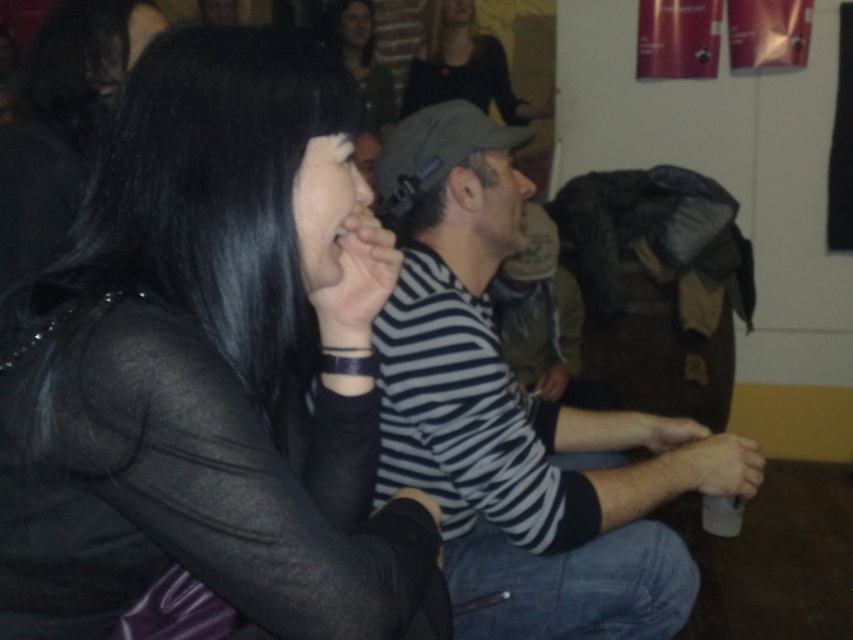
Consider the image. You are a photographer trying to capture a candid shot of the matte black hair at upper center and the white matte cup at lower center. Which object is closer to the camera lens?

The matte black hair at upper center is closer to the camera lens because it is further to the viewer than the white matte cup at lower center.

You are a photographer adjusting your camera settings to capture a closeup of the smooth beige sweater at upper center and the matte black hair at upper center. Given the camera has a depth of field that can sharply focus on objects within 30 centimeters of each other, will both subjects be in focus?

The smooth beige sweater at upper center and the matte black hair at upper center are 29.06 centimeters apart, which is within the 30 centimeter depth of field range. Therefore, both subjects will be in focus.